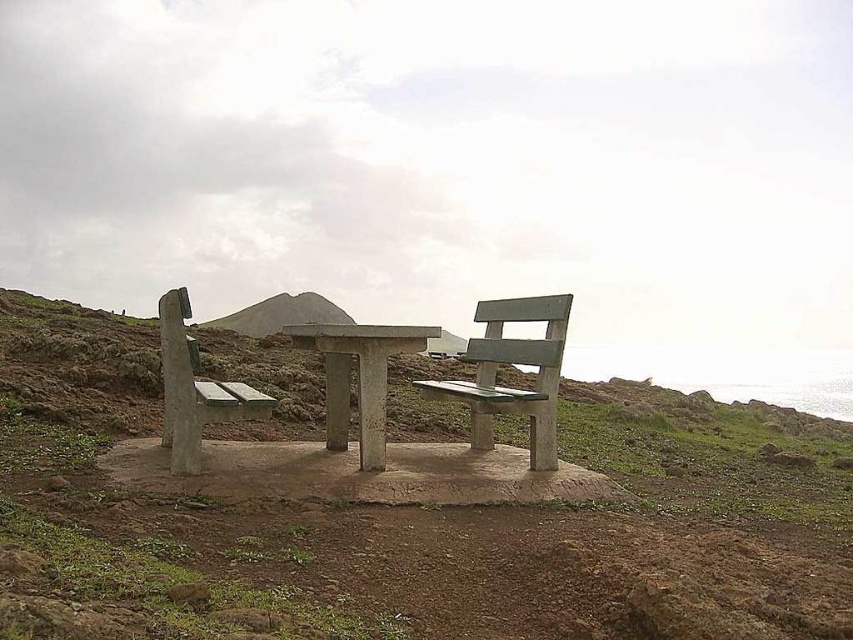
Which is behind, point (315, 324) or point (222, 396)?

The point (315, 324) is behind.

Is concrete bench at center below smooth concrete bench at left?

Yes, concrete bench at center is below smooth concrete bench at left.

Find the location of a particular element. Image resolution: width=853 pixels, height=640 pixels. concrete bench at center is located at coordinates (358, 378).

Does point (613, 525) lie behind point (242, 308)?

No, (613, 525) is in front of (242, 308).

Is green matte bench at center above brushed concrete hillside at center?

No.

Is point (532, 570) positioned before point (248, 321)?

Yes.

Locate an element on the screen. green matte bench at center is located at coordinates (415, 516).

Does green painted wood bench at center appear on the right side of brushed concrete hillside at center?

Yes, green painted wood bench at center is to the right of brushed concrete hillside at center.

Is point (474, 355) farther from camera compared to point (270, 332)?

No, it is in front of (270, 332).

I want to click on green painted wood bench at center, so coord(512,364).